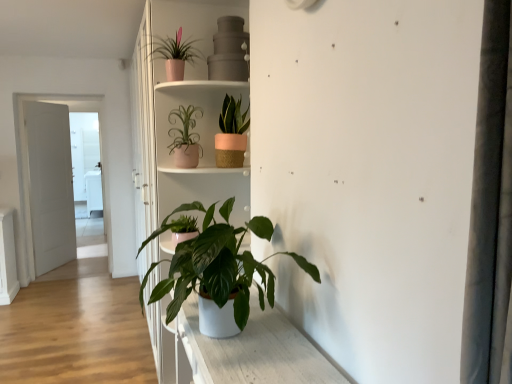
In order to click on white matte door at left in this screenshot , I will do `click(50, 185)`.

What is the approximate height of matte pink pot at upper center, acting as the second houseplant starting from the bottom?

13.29 inches.

The width and height of the screenshot is (512, 384). What do you see at coordinates (217, 264) in the screenshot?
I see `green matte plant at center, which is counted as the 1th houseplant, starting from the bottom` at bounding box center [217, 264].

Identify the location of white matte door at left. The height and width of the screenshot is (384, 512). (50, 185).

Is matte pink pot at upper center, which is the third houseplant in top-to-bottom order, not within white matte bookshelf at center?

Yes.

Which object is closer to the camera taking this photo, matte pink pot at upper center, which is the third houseplant in top-to-bottom order, or white matte bookshelf at center?

matte pink pot at upper center, which is the third houseplant in top-to-bottom order.

Can you confirm if matte pink pot at upper center, acting as the second houseplant starting from the bottom, is positioned to the right of white matte bookshelf at center?

Indeed, matte pink pot at upper center, acting as the second houseplant starting from the bottom, is positioned on the right side of white matte bookshelf at center.

Is pink matte pot at upper center, marked as the 1th houseplant in a top-to-bottom arrangement, not inside white matte door at left?

Yes, pink matte pot at upper center, marked as the 1th houseplant in a top-to-bottom arrangement, is outside of white matte door at left.

From the picture: From the image's perspective, which is below, pink matte pot at upper center, marked as the 1th houseplant in a top-to-bottom arrangement, or white matte door at left?

From the image's view, white matte door at left is below.

Can you confirm if pink matte pot at upper center, the 4th houseplant when ordered from bottom to top, is smaller than white matte door at left?

Yes, pink matte pot at upper center, the 4th houseplant when ordered from bottom to top, is smaller than white matte door at left.

Does pink matte pot at upper center, the 4th houseplant when ordered from bottom to top, touch white matte door at left?

No, pink matte pot at upper center, the 4th houseplant when ordered from bottom to top, is not with white matte door at left.

From a real-world perspective, is white matte bookshelf at center physically below matte pink woven pot at upper center, the 2th houseplant positioned from the top?

Correct, in the physical world, white matte bookshelf at center is lower than matte pink woven pot at upper center, the 2th houseplant positioned from the top.

Is there a large distance between white matte bookshelf at center and matte pink woven pot at upper center, the 2th houseplant positioned from the top?

No, there isn't a large distance between white matte bookshelf at center and matte pink woven pot at upper center, the 2th houseplant positioned from the top.

Does white matte bookshelf at center lie behind matte pink woven pot at upper center, the 2th houseplant positioned from the top?

Yes, the depth of white matte bookshelf at center is greater than that of matte pink woven pot at upper center, the 2th houseplant positioned from the top.

Based on the photo, how different are the orientations of white matte bookshelf at center and matte pink woven pot at upper center, the third houseplant from the bottom, in degrees?

10.8 degrees separate the facing orientations of white matte bookshelf at center and matte pink woven pot at upper center, the third houseplant from the bottom.

From their relative heights in the image, would you say white matte bookshelf at center is taller or shorter than matte pink pot at upper center, which is the third houseplant in top-to-bottom order?

white matte bookshelf at center is taller than matte pink pot at upper center, which is the third houseplant in top-to-bottom order.

Is white matte bookshelf at center aimed at matte pink pot at upper center, which is the third houseplant in top-to-bottom order?

No, white matte bookshelf at center is not turned towards matte pink pot at upper center, which is the third houseplant in top-to-bottom order.

Is white matte bookshelf at center next to matte pink pot at upper center, acting as the second houseplant starting from the bottom?

No, white matte bookshelf at center is not with matte pink pot at upper center, acting as the second houseplant starting from the bottom.

Is white matte bookshelf at center inside the boundaries of matte pink pot at upper center, which is the third houseplant in top-to-bottom order, or outside?

white matte bookshelf at center is spatially situated outside matte pink pot at upper center, which is the third houseplant in top-to-bottom order.

Considering the sizes of objects white matte door at left and pink matte pot at upper center, the 4th houseplant when ordered from bottom to top, in the image provided, who is wider, white matte door at left or pink matte pot at upper center, the 4th houseplant when ordered from bottom to top,?

With larger width is pink matte pot at upper center, the 4th houseplant when ordered from bottom to top.

From the image's perspective, between white matte door at left and pink matte pot at upper center, marked as the 1th houseplant in a top-to-bottom arrangement, who is located below?

white matte door at left.

Looking at this image, is white matte door at left looking in the opposite direction of pink matte pot at upper center, the 4th houseplant when ordered from bottom to top?

No, pink matte pot at upper center, the 4th houseplant when ordered from bottom to top, is not at the back of white matte door at left.

Is pink matte pot at upper center, marked as the 1th houseplant in a top-to-bottom arrangement, far away from matte pink woven pot at upper center, the third houseplant from the bottom?

That's not correct — pink matte pot at upper center, marked as the 1th houseplant in a top-to-bottom arrangement, is a little close to matte pink woven pot at upper center, the third houseplant from the bottom.

In the image, is pink matte pot at upper center, the 4th houseplant when ordered from bottom to top, positioned in front of or behind matte pink woven pot at upper center, the third houseplant from the bottom?

In the image, pink matte pot at upper center, the 4th houseplant when ordered from bottom to top, appears in front of matte pink woven pot at upper center, the third houseplant from the bottom.

Is pink matte pot at upper center, marked as the 1th houseplant in a top-to-bottom arrangement, looking in the opposite direction of matte pink woven pot at upper center, the 2th houseplant positioned from the top?

pink matte pot at upper center, marked as the 1th houseplant in a top-to-bottom arrangement, does not have its back to matte pink woven pot at upper center, the 2th houseplant positioned from the top.

In the scene shown: Which is more to the left, matte pink pot at upper center, which is the third houseplant in top-to-bottom order, or pink matte pot at upper center, the 4th houseplant when ordered from bottom to top?

Positioned to the left is pink matte pot at upper center, the 4th houseplant when ordered from bottom to top.

From a real-world perspective, is matte pink pot at upper center, which is the third houseplant in top-to-bottom order, physically located above or below pink matte pot at upper center, the 4th houseplant when ordered from bottom to top?

Clearly, from a real-world perspective, matte pink pot at upper center, which is the third houseplant in top-to-bottom order, is below pink matte pot at upper center, the 4th houseplant when ordered from bottom to top.

Identify the location of bookshelf located on the left of matte pink pot at upper center, which is the third houseplant in top-to-bottom order. (186, 105).

The width and height of the screenshot is (512, 384). Identify the location of door behind the pink matte pot at upper center, the 4th houseplant when ordered from bottom to top. (50, 185).

From the image, which object appears to be farther from matte pink pot at upper center, acting as the second houseplant starting from the bottom, white matte door at left or matte pink woven pot at upper center, the third houseplant from the bottom?

white matte door at left lies further to matte pink pot at upper center, acting as the second houseplant starting from the bottom, than the other object.

Considering their positions, is matte pink pot at upper center, which is the third houseplant in top-to-bottom order, positioned closer to matte pink woven pot at upper center, the third houseplant from the bottom, than white matte bookshelf at center?

matte pink pot at upper center, which is the third houseplant in top-to-bottom order.

Based on their spatial positions, is green matte plant at center, positioned as the 4th houseplant in top-to-bottom order, or white matte bookshelf at center further from white matte door at left?

The object further to white matte door at left is green matte plant at center, positioned as the 4th houseplant in top-to-bottom order.

Based on the photo, looking at the image, which one is located closer to green matte plant at center, positioned as the 4th houseplant in top-to-bottom order, white matte bookshelf at center or matte pink woven pot at upper center, the third houseplant from the bottom?

The object closer to green matte plant at center, positioned as the 4th houseplant in top-to-bottom order, is white matte bookshelf at center.

Which object lies further to the anchor point white matte bookshelf at center, pink matte pot at upper center, the 4th houseplant when ordered from bottom to top, or white matte door at left?

Based on the image, white matte door at left appears to be further to white matte bookshelf at center.

Estimate the real-world distances between objects in this image. Which object is further from white matte door at left, matte pink woven pot at upper center, the 2th houseplant positioned from the top, or matte pink pot at upper center, acting as the second houseplant starting from the bottom?

matte pink woven pot at upper center, the 2th houseplant positioned from the top.

Estimate the real-world distances between objects in this image. Which object is closer to matte pink pot at upper center, which is the third houseplant in top-to-bottom order, matte pink woven pot at upper center, the third houseplant from the bottom, or green matte plant at center, positioned as the 4th houseplant in top-to-bottom order?

The object closer to matte pink pot at upper center, which is the third houseplant in top-to-bottom order, is matte pink woven pot at upper center, the third houseplant from the bottom.

Based on their spatial positions, is green matte plant at center, which is counted as the 1th houseplant, starting from the bottom, or pink matte pot at upper center, the 4th houseplant when ordered from bottom to top, closer to matte pink woven pot at upper center, the third houseplant from the bottom?

pink matte pot at upper center, the 4th houseplant when ordered from bottom to top, is closer to matte pink woven pot at upper center, the third houseplant from the bottom.

The image size is (512, 384). In order to click on bookshelf located between matte pink pot at upper center, acting as the second houseplant starting from the bottom, and white matte door at left in the depth direction in this screenshot , I will do `click(186, 105)`.

Locate an element on the screen. bookshelf located between green matte plant at center, which is counted as the 1th houseplant, starting from the bottom, and white matte door at left in the depth direction is located at coordinates (186, 105).

Where is `bookshelf between pink matte pot at upper center, the 4th houseplant when ordered from bottom to top, and white matte door at left, along the z-axis`? This screenshot has height=384, width=512. bookshelf between pink matte pot at upper center, the 4th houseplant when ordered from bottom to top, and white matte door at left, along the z-axis is located at coordinates (186, 105).

Where is `houseplant between pink matte pot at upper center, the 4th houseplant when ordered from bottom to top, and matte pink pot at upper center, which is the third houseplant in top-to-bottom order, in the vertical direction`? houseplant between pink matte pot at upper center, the 4th houseplant when ordered from bottom to top, and matte pink pot at upper center, which is the third houseplant in top-to-bottom order, in the vertical direction is located at coordinates (231, 134).